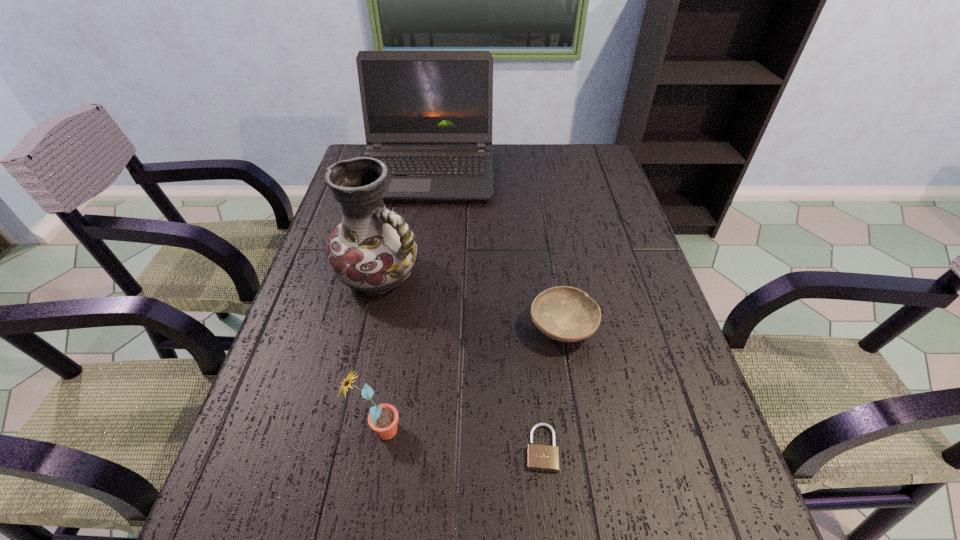
You are a GUI agent. You are given a task and a screenshot of the screen. Output one action in this format:
    pyautogui.click(x=<x>, y=<y>)
    Task: Click on the laptop_computer
    The height and width of the screenshot is (540, 960).
    Given the screenshot: What is the action you would take?
    pyautogui.click(x=427, y=115)

I want to click on vase, so click(x=373, y=250).

The image size is (960, 540). Find the location of `the third shortest object`. the third shortest object is located at coordinates (383, 419).

Find the location of a particular element. Image resolution: width=960 pixels, height=540 pixels. the fourth tallest object is located at coordinates (566, 314).

Identify the location of the shortest object. (540, 457).

Identify the location of blank space located on the screen of the farthest object. This screenshot has width=960, height=540. (417, 239).

You are a GUI agent. You are given a task and a screenshot of the screen. Output one action in this format:
    pyautogui.click(x=<x>, y=<y>)
    Task: Click on the vacant area situated 0.080m on the back of the vase
    Image resolution: width=960 pixels, height=540 pixels.
    Given the screenshot: What is the action you would take?
    pyautogui.click(x=391, y=228)

Where is `free space located on the flower of the third shortest object`? free space located on the flower of the third shortest object is located at coordinates (503, 430).

Image resolution: width=960 pixels, height=540 pixels. Find the location of `free space located on the left of the second shortest object`. free space located on the left of the second shortest object is located at coordinates (392, 327).

What are the coordinates of `blank space located 0.060m on the left of the padlock` in the screenshot? It's located at (492, 448).